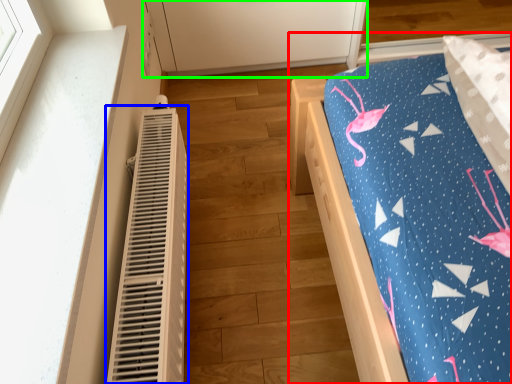
Question: Estimate the real-world distances between objects in this image. Which object is farther from furniture (highlighted by a red box), heater (highlighted by a blue box) or cabinetry (highlighted by a green box)?

Choices:
 (A) heater
 (B) cabinetry

Answer: (B)